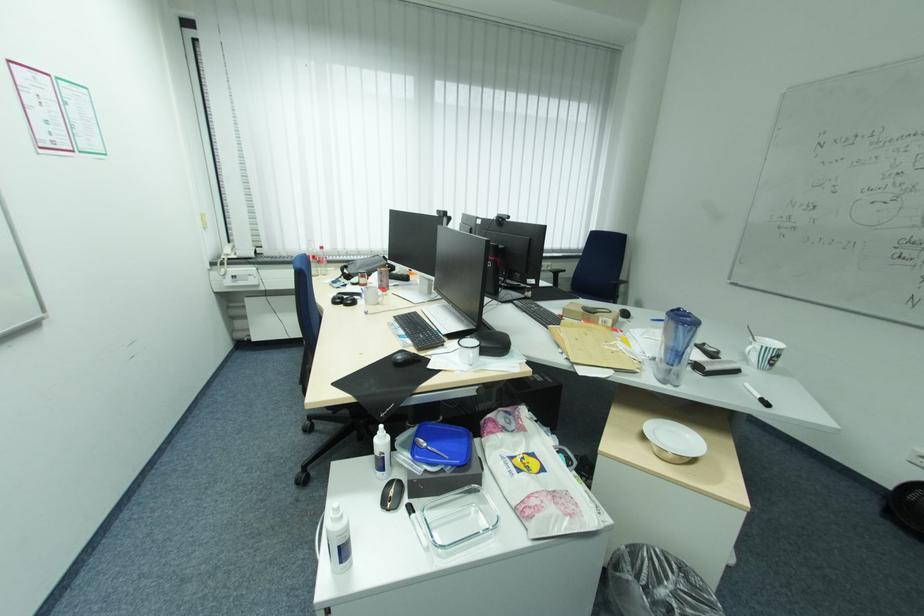
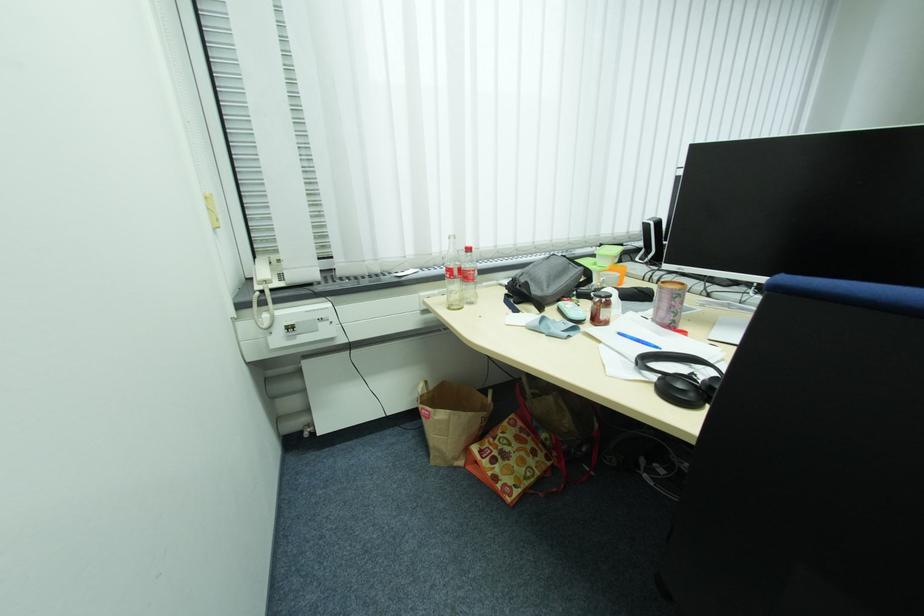
Question: I am providing you with two images of the same scene from different viewpoints. Please identify which objects are invisible in image2.

Choices:
 (A) orange plastic cup
 (B) light blue case
 (C) patterned tote bag
 (D) none of these

Answer: (D)